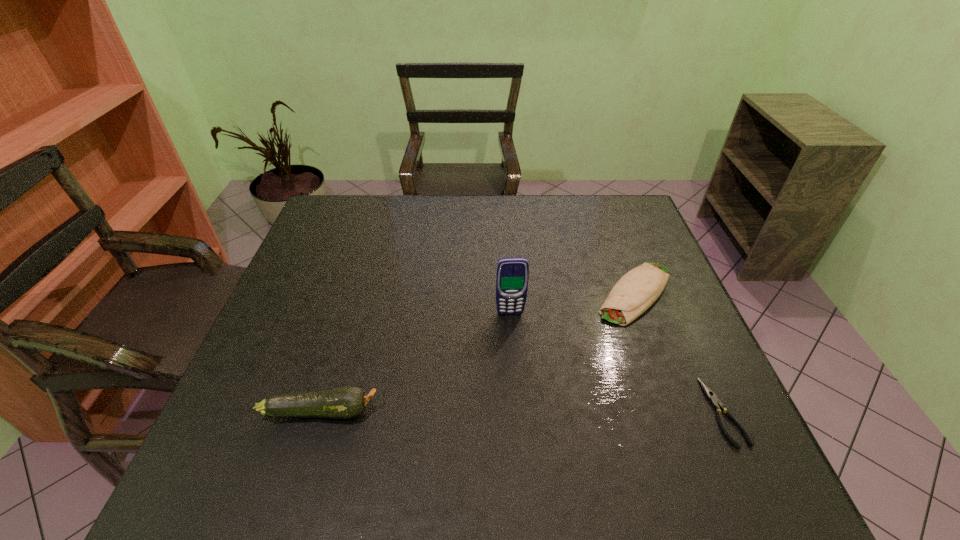
You are a GUI agent. You are given a task and a screenshot of the screen. Output one action in this format:
    pyautogui.click(x=<x>, y=<y>)
    Task: Click on the third shortest object
    The image size is (960, 540).
    Given the screenshot: What is the action you would take?
    pyautogui.click(x=345, y=402)

The width and height of the screenshot is (960, 540). Find the location of `zucchini`. zucchini is located at coordinates (345, 402).

The width and height of the screenshot is (960, 540). Find the location of `the shortest object`. the shortest object is located at coordinates (711, 396).

Locate an element on the screen. Image resolution: width=960 pixels, height=540 pixels. the second shortest object is located at coordinates (638, 289).

You are a GUI agent. You are given a task and a screenshot of the screen. Output one action in this format:
    pyautogui.click(x=<x>, y=<y>)
    Task: Click on the tallest object
    The image size is (960, 540).
    Given the screenshot: What is the action you would take?
    pyautogui.click(x=512, y=274)

Locate an element on the screen. This screenshot has height=540, width=960. cellular telephone is located at coordinates (512, 274).

Locate an element on the screen. This screenshot has height=540, width=960. vacant space located at the blossom end of the second tallest object is located at coordinates (427, 411).

You are a GUI agent. You are given a task and a screenshot of the screen. Output one action in this format:
    pyautogui.click(x=<x>, y=<y>)
    Task: Click on the blank space located on the back of the shortest object
    
    Given the screenshot: What is the action you would take?
    pyautogui.click(x=683, y=321)

You are a GUI agent. You are given a task and a screenshot of the screen. Output one action in this format:
    pyautogui.click(x=<x>, y=<y>)
    Task: Click on the vacant space located 0.260m at the bitten end of the burrito
    This screenshot has width=960, height=540.
    Given the screenshot: What is the action you would take?
    pyautogui.click(x=556, y=382)

The height and width of the screenshot is (540, 960). What are the coordinates of `vacant space located at the bitten end of the burrito` in the screenshot? It's located at (589, 345).